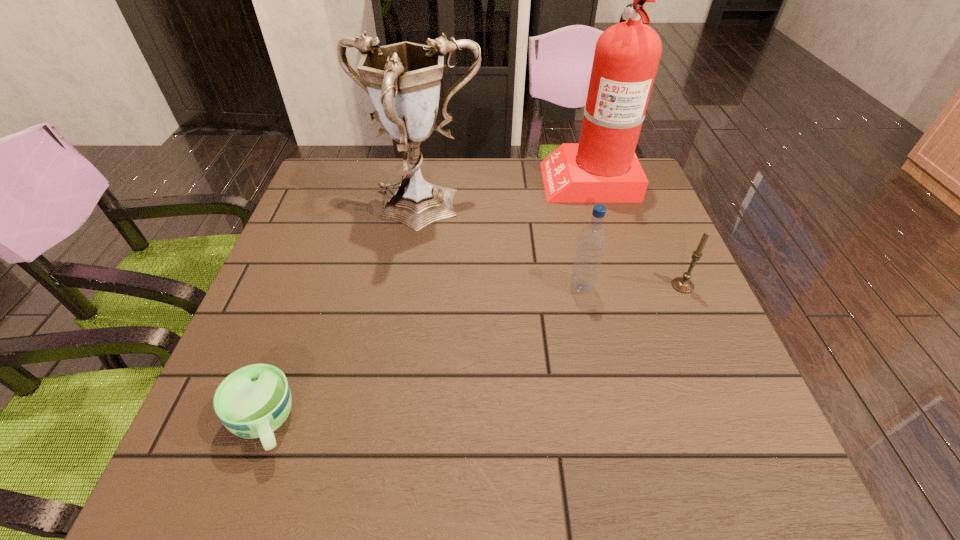
Where is `vacant area in the image that satisfies the following two spatial constraints: 1. on the front-facing side of the fire extinguisher; 2. on the front side of the shortest object`? vacant area in the image that satisfies the following two spatial constraints: 1. on the front-facing side of the fire extinguisher; 2. on the front side of the shortest object is located at coordinates (660, 423).

Where is `free region that satisfies the following two spatial constraints: 1. on the front-facing side of the fire extinguisher; 2. on the front side of the trophy cup`? This screenshot has width=960, height=540. free region that satisfies the following two spatial constraints: 1. on the front-facing side of the fire extinguisher; 2. on the front side of the trophy cup is located at coordinates (597, 211).

The width and height of the screenshot is (960, 540). Identify the location of vacant point that satisfies the following two spatial constraints: 1. on the front-facing side of the fire extinguisher; 2. on the front side of the cup. (660, 423).

Where is `free space that satisfies the following two spatial constraints: 1. on the back side of the third shortest object; 2. on the right side of the cup`? free space that satisfies the following two spatial constraints: 1. on the back side of the third shortest object; 2. on the right side of the cup is located at coordinates (313, 287).

In order to click on free region that satisfies the following two spatial constraints: 1. on the back side of the fourth tallest object; 2. on the front-facing side of the fire extinguisher in this screenshot , I will do `click(636, 179)`.